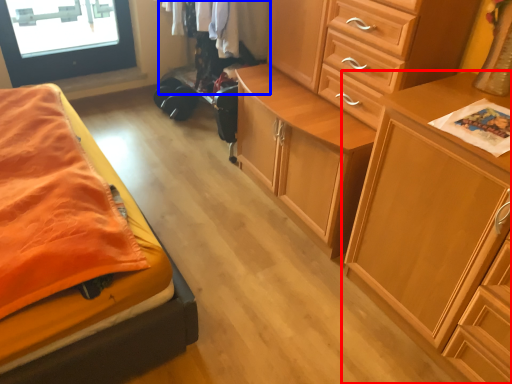
Question: Which object appears farthest to the camera in this image, chest of drawers (highlighted by a red box) or clothing (highlighted by a blue box)?

Choices:
 (A) chest of drawers
 (B) clothing

Answer: (B)